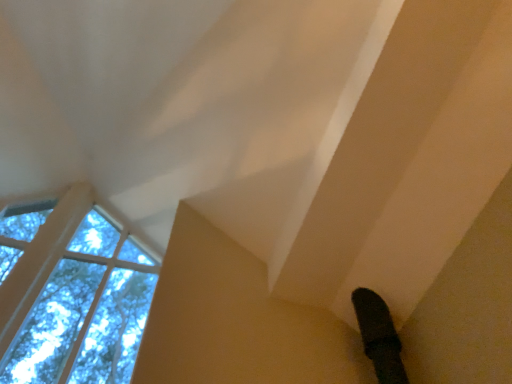
Where is `clear glass window at upper left`? This screenshot has height=384, width=512. clear glass window at upper left is located at coordinates (71, 294).

The width and height of the screenshot is (512, 384). What do you see at coordinates (71, 294) in the screenshot? I see `clear glass window at upper left` at bounding box center [71, 294].

This screenshot has width=512, height=384. I want to click on clear glass window at upper left, so click(71, 294).